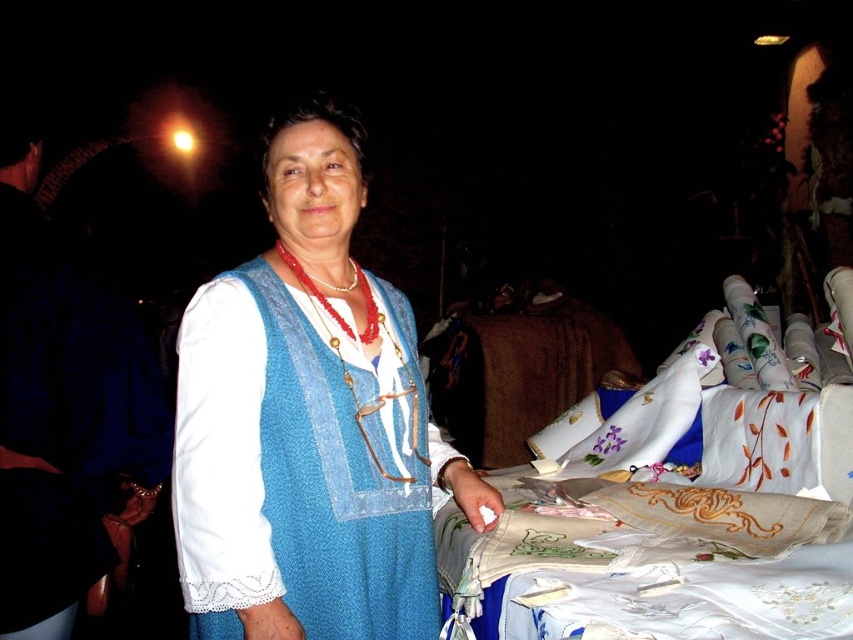
Where is the blue knitted vest at center located in the image?

The blue knitted vest at center is located at point (308, 422) in the image.

You are a customer at a craft fair and want to examine both the blue knitted vest at center and the white embroidered cloth at center. Which item should you approach first to get a closer look without moving your position?

The blue knitted vest at center is closer to you than the white embroidered cloth at center, so you should examine it first without moving your position.

Based on the scene description, can you determine which object is positioned higher between the blue knitted vest at center and the white embroidered cloth at center?

The blue knitted vest at center is above the white embroidered cloth at center, so it is positioned higher.